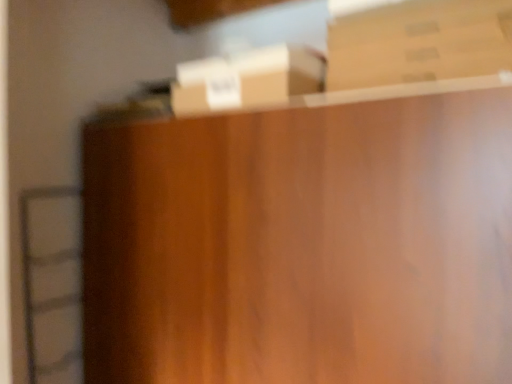
Question: Is brown cardboard box at upper center, the 1th box positioned from the bottom, surrounding brown cardboard box at upper right, acting as the second box starting from the left?

Choices:
 (A) yes
 (B) no

Answer: (B)

Question: Is brown cardboard box at upper center, the 1th box positioned from the bottom, thinner than brown cardboard box at upper right, acting as the second box starting from the left?

Choices:
 (A) yes
 (B) no

Answer: (A)

Question: Is brown cardboard box at upper center, which is the 2th box from right to left, facing away from brown cardboard box at upper right, positioned as the 1th box in top-to-bottom order?

Choices:
 (A) no
 (B) yes

Answer: (A)

Question: Is brown cardboard box at upper center, the second box viewed from the top, closer to camera compared to brown cardboard box at upper right, positioned as the 1th box in top-to-bottom order?

Choices:
 (A) yes
 (B) no

Answer: (B)

Question: Is brown cardboard box at upper center, the first box positioned from the left, behind brown cardboard box at upper right, the second box from the bottom?

Choices:
 (A) yes
 (B) no

Answer: (A)

Question: Is brown cardboard box at upper center, the first box positioned from the left, outside brown cardboard box at upper right, which is the first box from right to left?

Choices:
 (A) yes
 (B) no

Answer: (A)

Question: Considering the relative sizes of brown cardboard box at upper right, positioned as the 1th box in top-to-bottom order, and brown cardboard box at upper center, the second box viewed from the top, in the image provided, is brown cardboard box at upper right, positioned as the 1th box in top-to-bottom order, taller than brown cardboard box at upper center, the second box viewed from the top,?

Choices:
 (A) yes
 (B) no

Answer: (B)

Question: Can you confirm if brown cardboard box at upper right, positioned as the 1th box in top-to-bottom order, is positioned to the right of brown cardboard box at upper center, the second box viewed from the top?

Choices:
 (A) no
 (B) yes

Answer: (B)

Question: Does brown cardboard box at upper right, which is the first box from right to left, come in front of brown cardboard box at upper center, which is the 2th box from right to left?

Choices:
 (A) yes
 (B) no

Answer: (A)

Question: Is brown cardboard box at upper right, acting as the second box starting from the left, next to brown cardboard box at upper center, the second box viewed from the top?

Choices:
 (A) no
 (B) yes

Answer: (A)

Question: Is brown cardboard box at upper right, the second box from the bottom, wider than brown cardboard box at upper center, the first box positioned from the left?

Choices:
 (A) no
 (B) yes

Answer: (B)

Question: From the image's perspective, is brown cardboard box at upper right, the second box from the bottom, above brown cardboard box at upper center, the 1th box positioned from the bottom?

Choices:
 (A) yes
 (B) no

Answer: (A)

Question: Is brown cardboard box at upper right, which is the first box from right to left, in front of or behind brown cardboard box at upper center, which is the 2th box from right to left, in the image?

Choices:
 (A) behind
 (B) front

Answer: (B)